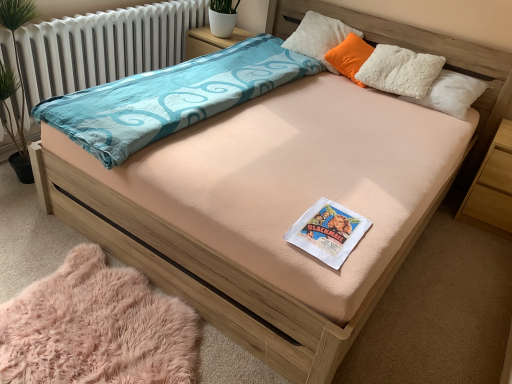
I want to click on vacant region above pink fluffy rug at lower left (from a real-world perspective), so click(100, 331).